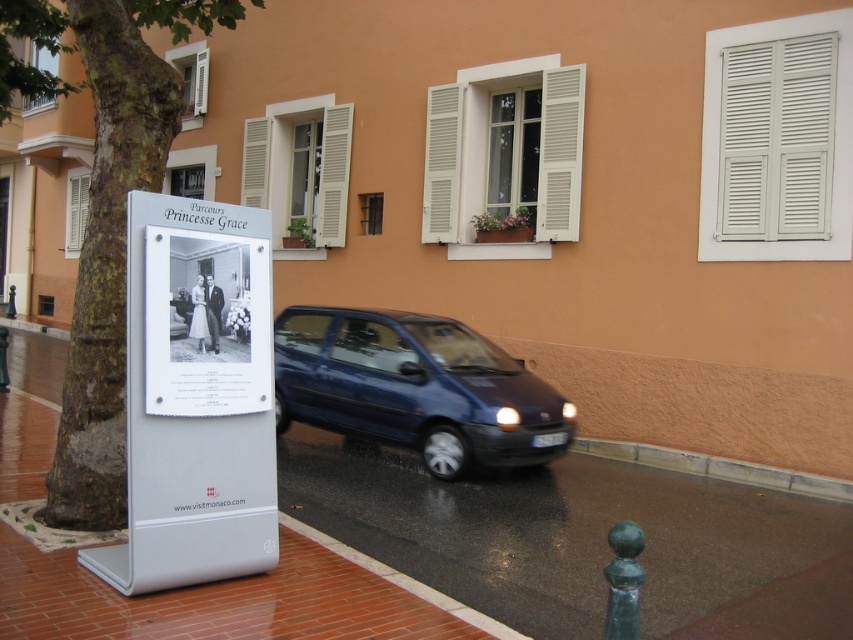
Question: Among these points, which one is nearest to the camera?

Choices:
 (A) (148, 156)
 (B) (334, 342)

Answer: (A)

Question: Considering the relative positions of white wooden shutters at upper right and white wooden shutter at upper left in the image provided, where is white wooden shutters at upper right located with respect to white wooden shutter at upper left?

Choices:
 (A) below
 (B) above

Answer: (A)

Question: Is white wooden shutters at upper right in front of white matte shutters at center?

Choices:
 (A) no
 (B) yes

Answer: (B)

Question: Which of the following is the farthest from the observer?

Choices:
 (A) (456, 186)
 (B) (828, 476)

Answer: (A)

Question: Is white wooden shutters at upper right below gray concrete curb at lower right?

Choices:
 (A) no
 (B) yes

Answer: (A)

Question: Based on their relative distances, which object is farther from the white matte shutters at center?

Choices:
 (A) white wooden shutter at upper left
 (B) white wooden shutters at upper right
 (C) brown rough tree at left

Answer: (A)